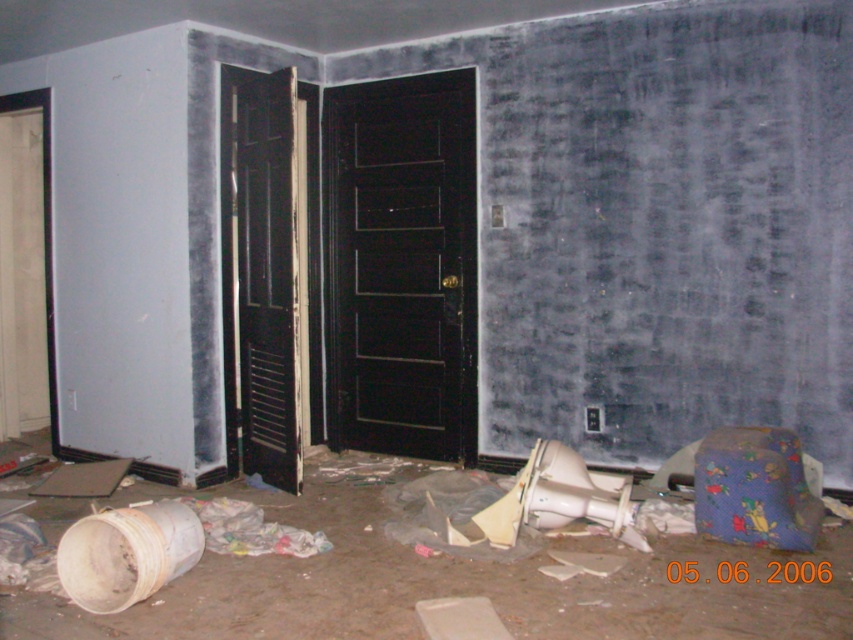
In the scene shown: Can you confirm if black matte door at center is smaller than black wooden door at center?

Incorrect, black matte door at center is not smaller in size than black wooden door at center.

Is black matte door at center above black wooden door at center?

Yes, black matte door at center is above black wooden door at center.

Is point (322, 148) less distant than point (270, 170)?

No.

At what (x,y) coordinates should I click in order to perform the action: click on black matte door at center. Please return your answer as a coordinate pair (x, y). Looking at the image, I should click on (399, 266).